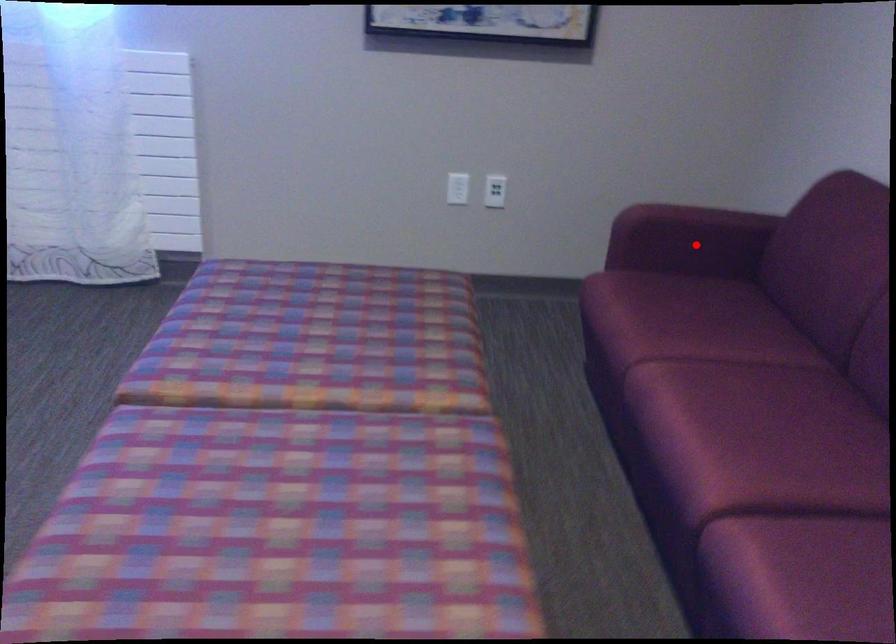
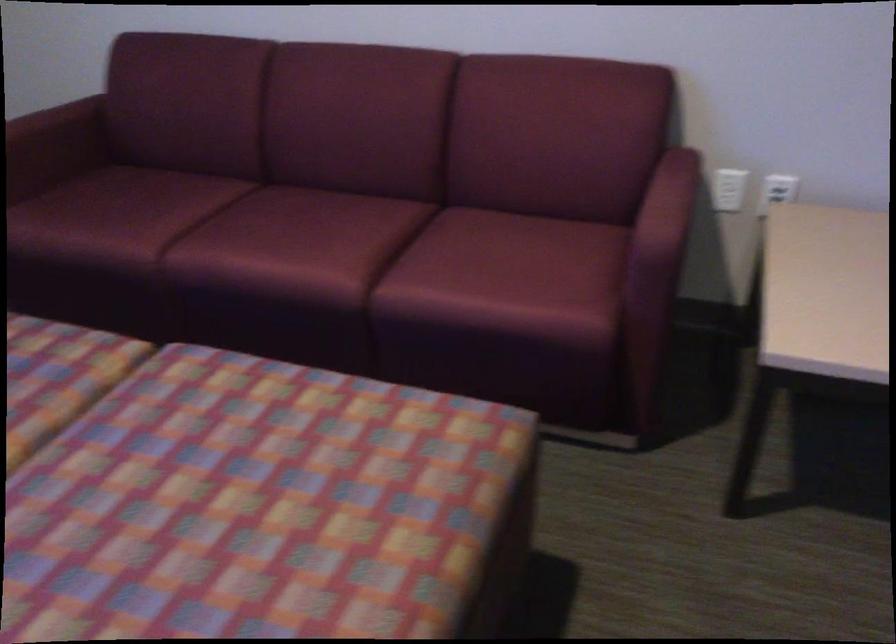
Find the pixel in the second image that matches the highlighted location in the first image.

(55, 147)